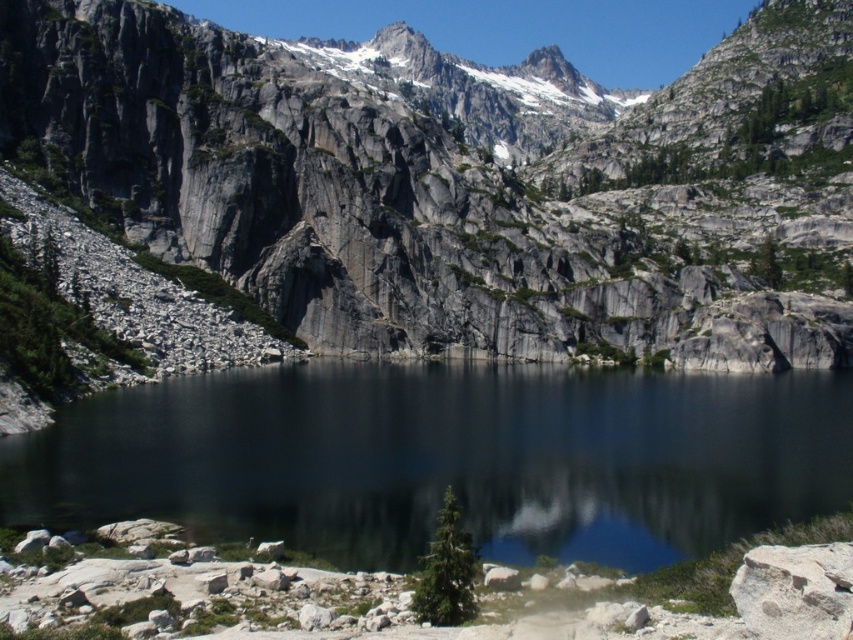
In the scene shown: Can you confirm if gray rock mountain at center is thinner than smooth dark water at center?

In fact, gray rock mountain at center might be wider than smooth dark water at center.

Does point (781, 86) come in front of point (384, 547)?

No, (781, 86) is behind (384, 547).

Measure the distance between gray rock mountain at center and camera.

The distance of gray rock mountain at center from camera is 340.54 feet.

Locate an element on the screen. The image size is (853, 640). gray rock mountain at center is located at coordinates (463, 180).